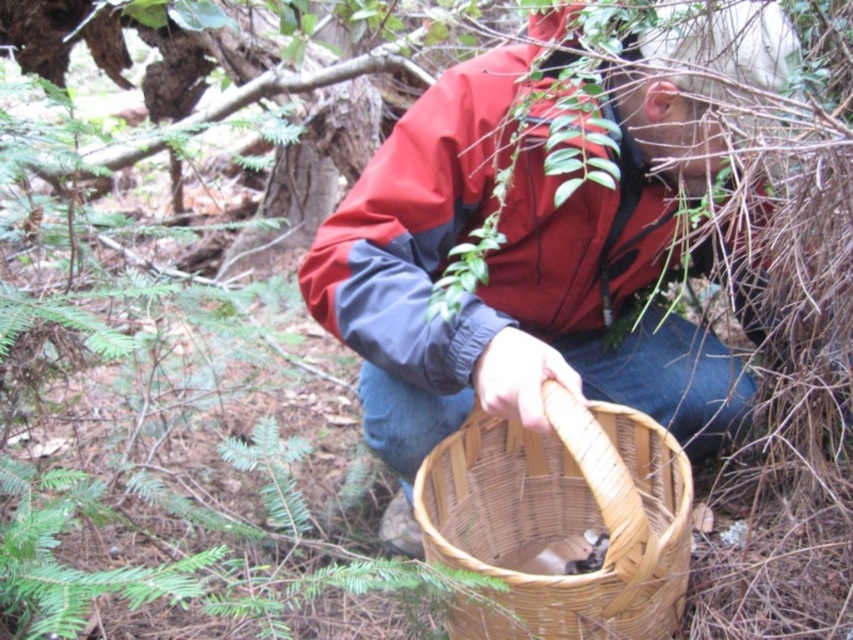
You are a nature guide leading a group through the forest. You notice two baskets in the scene. The first is a matte brown basket at center, and the second is a woven bamboo basket at lower center. Which basket is taller?

The matte brown basket at center is much taller than the woven bamboo basket at lower center.